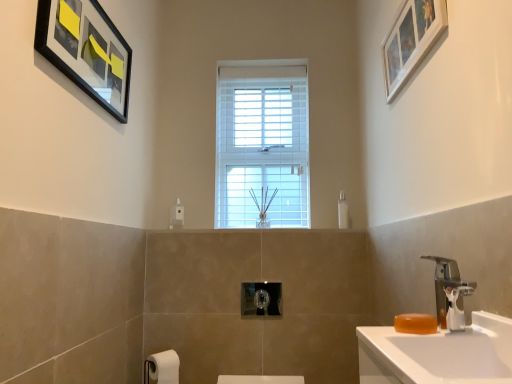
This screenshot has width=512, height=384. Describe the element at coordinates (450, 292) in the screenshot. I see `silver metallic faucet at right` at that location.

Measure the distance between point (252,125) and camera.

The distance of point (252,125) from camera is 2.54 meters.

Where is `polished chrome towel bar at center`? The width and height of the screenshot is (512, 384). polished chrome towel bar at center is located at coordinates (261, 298).

In order to face black matte picture frame at upper left, positioned as the second picture frame in right-to-left order, should I rotate leftwards or rightwards?

Turn left approximately 20.368 degrees to face it.

What do you see at coordinates (86, 50) in the screenshot?
I see `black matte picture frame at upper left, positioned as the second picture frame in right-to-left order` at bounding box center [86, 50].

Where is `transparent plastic soap dispenser at center-right`? This screenshot has height=384, width=512. transparent plastic soap dispenser at center-right is located at coordinates (x=342, y=211).

You are a GUI agent. You are given a task and a screenshot of the screen. Output one action in this format:
    pyautogui.click(x=<x>, y=<y>)
    Task: Click on the silver metallic faucet at right
    
    Given the screenshot: What is the action you would take?
    pyautogui.click(x=450, y=292)

Considering the sizes of objects transparent plastic soap dispenser at center-right and white wooden picture frame at upper right, marked as the second picture frame in a left-to-right arrangement, in the image provided, who is thinner, transparent plastic soap dispenser at center-right or white wooden picture frame at upper right, marked as the second picture frame in a left-to-right arrangement,?

white wooden picture frame at upper right, marked as the second picture frame in a left-to-right arrangement.

Looking at this image, which of these two, transparent plastic soap dispenser at center-right or white wooden picture frame at upper right, marked as the second picture frame in a left-to-right arrangement, stands shorter?

transparent plastic soap dispenser at center-right is shorter.

Does transparent plastic soap dispenser at center-right come in front of white wooden picture frame at upper right, the 1th picture frame positioned from the right?

No.

From the image's perspective, which one is positioned higher, transparent plastic soap dispenser at center-right or polished chrome towel bar at center?

From the image's view, transparent plastic soap dispenser at center-right is above.

Which object is further away from the camera, transparent plastic soap dispenser at center-right or polished chrome towel bar at center?

transparent plastic soap dispenser at center-right is further from the camera.

Could polished chrome towel bar at center be considered to be inside transparent plastic soap dispenser at center-right?

No.

Based on their sizes in the image, would you say transparent plastic soap dispenser at center-right is bigger or smaller than polished chrome towel bar at center?

Clearly, transparent plastic soap dispenser at center-right is smaller in size than polished chrome towel bar at center.

Is white wooden picture frame at upper right, marked as the second picture frame in a left-to-right arrangement, aimed at polished chrome towel bar at center?

No, white wooden picture frame at upper right, marked as the second picture frame in a left-to-right arrangement, does not turn towards polished chrome towel bar at center.

Is white wooden picture frame at upper right, marked as the second picture frame in a left-to-right arrangement, not near polished chrome towel bar at center?

Yes.

Which is farther, [393,44] or [246,295]?

Point [246,295]

Which of these two, white wooden picture frame at upper right, the 1th picture frame positioned from the right, or black matte picture frame at upper left, positioned as the second picture frame in right-to-left order, is smaller?

white wooden picture frame at upper right, the 1th picture frame positioned from the right, is smaller.

Based on the photo, measure the distance between white wooden picture frame at upper right, the 1th picture frame positioned from the right, and black matte picture frame at upper left, marked as the 1th picture frame in a left-to-right arrangement.

A distance of 3.53 feet exists between white wooden picture frame at upper right, the 1th picture frame positioned from the right, and black matte picture frame at upper left, marked as the 1th picture frame in a left-to-right arrangement.

Would you say white wooden picture frame at upper right, the 1th picture frame positioned from the right, is to the left or to the right of black matte picture frame at upper left, positioned as the second picture frame in right-to-left order, in the picture?

white wooden picture frame at upper right, the 1th picture frame positioned from the right, is positioned on black matte picture frame at upper left, positioned as the second picture frame in right-to-left order,'s right side.

Is white wooden picture frame at upper right, marked as the second picture frame in a left-to-right arrangement, turned away from black matte picture frame at upper left, marked as the 1th picture frame in a left-to-right arrangement?

That's not correct — white wooden picture frame at upper right, marked as the second picture frame in a left-to-right arrangement, is not looking away from black matte picture frame at upper left, marked as the 1th picture frame in a left-to-right arrangement.

Is orange translucent soap at lower right shorter than black matte picture frame at upper left, marked as the 1th picture frame in a left-to-right arrangement?

Yes.

Is orange translucent soap at lower right wider than black matte picture frame at upper left, marked as the 1th picture frame in a left-to-right arrangement?

Indeed, orange translucent soap at lower right has a greater width compared to black matte picture frame at upper left, marked as the 1th picture frame in a left-to-right arrangement.

From a real-world perspective, is orange translucent soap at lower right located higher than black matte picture frame at upper left, marked as the 1th picture frame in a left-to-right arrangement?

No.

Is orange translucent soap at lower right facing towards black matte picture frame at upper left, positioned as the second picture frame in right-to-left order?

No, orange translucent soap at lower right is not facing towards black matte picture frame at upper left, positioned as the second picture frame in right-to-left order.

Considering the points (479, 331) and (440, 307), which point is behind, point (479, 331) or point (440, 307)?

Positioned behind is point (440, 307).

Which object is closer to the camera taking this photo, white glossy sink at right or silver metallic faucet at right?

white glossy sink at right is more forward.

From the image's perspective, between white glossy sink at right and silver metallic faucet at right, which one is located above?

silver metallic faucet at right appears higher in the image.

Who is more distant, transparent plastic soap dispenser at center-right or black matte picture frame at upper left, marked as the 1th picture frame in a left-to-right arrangement?

transparent plastic soap dispenser at center-right is more distant.

Is there a large distance between transparent plastic soap dispenser at center-right and black matte picture frame at upper left, marked as the 1th picture frame in a left-to-right arrangement?

transparent plastic soap dispenser at center-right is positioned a significant distance from black matte picture frame at upper left, marked as the 1th picture frame in a left-to-right arrangement.

From a real-world perspective, is transparent plastic soap dispenser at center-right beneath black matte picture frame at upper left, positioned as the second picture frame in right-to-left order?

Indeed, from a real-world perspective, transparent plastic soap dispenser at center-right is positioned beneath black matte picture frame at upper left, positioned as the second picture frame in right-to-left order.

Considering the positions of objects transparent plastic soap dispenser at center-right and black matte picture frame at upper left, marked as the 1th picture frame in a left-to-right arrangement, in the image provided, who is more to the left, transparent plastic soap dispenser at center-right or black matte picture frame at upper left, marked as the 1th picture frame in a left-to-right arrangement,?

black matte picture frame at upper left, marked as the 1th picture frame in a left-to-right arrangement, is more to the left.

You are a GUI agent. You are given a task and a screenshot of the screen. Output one action in this format:
    pyautogui.click(x=<x>, y=<y>)
    Task: Click on the soap dispenser that is on the left side of white wooden picture frame at upper right, the 1th picture frame positioned from the right
    Image resolution: width=512 pixels, height=384 pixels.
    Given the screenshot: What is the action you would take?
    pyautogui.click(x=342, y=211)

The image size is (512, 384). I want to click on towel bar below the transparent plastic soap dispenser at center-right (from a real-world perspective), so click(x=261, y=298).

Estimate the real-world distances between objects in this image. Which object is further from polished chrome towel bar at center, white glossy sink at right or orange translucent soap at lower right?

orange translucent soap at lower right.

Which object lies nearer to the anchor point black matte picture frame at upper left, positioned as the second picture frame in right-to-left order, white wooden picture frame at upper right, marked as the second picture frame in a left-to-right arrangement, or transparent plastic soap dispenser at center-right?

The object closer to black matte picture frame at upper left, positioned as the second picture frame in right-to-left order, is white wooden picture frame at upper right, marked as the second picture frame in a left-to-right arrangement.

Considering their positions, is white wooden window at center positioned closer to silver metallic faucet at right than orange translucent soap at lower right?

orange translucent soap at lower right is positioned closer to the anchor silver metallic faucet at right.

Which object lies further to the anchor point orange translucent soap at lower right, white glossy sink at right or polished chrome towel bar at center?

The object further to orange translucent soap at lower right is polished chrome towel bar at center.

Considering their positions, is white wooden window at center positioned further to orange translucent soap at lower right than transparent plastic soap dispenser at center-right?

white wooden window at center is positioned further to the anchor orange translucent soap at lower right.

Based on their spatial positions, is black matte picture frame at upper left, positioned as the second picture frame in right-to-left order, or polished chrome towel bar at center further from silver metallic faucet at right?

Among the two, black matte picture frame at upper left, positioned as the second picture frame in right-to-left order, is located further to silver metallic faucet at right.

Looking at the image, which one is located closer to white matte toilet paper at lower left, polished chrome towel bar at center or transparent plastic soap dispenser at center-right?

polished chrome towel bar at center.

Looking at the image, which one is located closer to silver metallic faucet at right, polished chrome towel bar at center or transparent plastic soap dispenser at center-right?

Based on the image, polished chrome towel bar at center appears to be nearer to silver metallic faucet at right.

The height and width of the screenshot is (384, 512). What are the coordinates of `soap between white glossy sink at right and white wooden window at center in the front-back direction` in the screenshot? It's located at (415, 323).

At what (x,y) coordinates should I click in order to perform the action: click on tap positioned between orange translucent soap at lower right and transparent plastic soap dispenser at center-right from near to far. Please return your answer as a coordinate pair (x, y). This screenshot has width=512, height=384. Looking at the image, I should click on (450, 292).

Find the location of a particular element. tap located between white glossy sink at right and transparent plastic soap dispenser at center-right in the depth direction is located at coordinates (450, 292).

The image size is (512, 384). I want to click on window between black matte picture frame at upper left, positioned as the second picture frame in right-to-left order, and white matte toilet paper at lower left, in the vertical direction, so click(x=262, y=144).